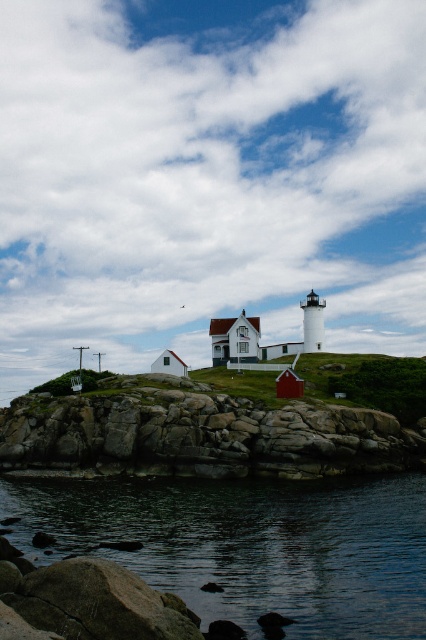
Can you confirm if dark blue water at lower center is positioned to the left of rocky cliff at lower left?

In fact, dark blue water at lower center is to the right of rocky cliff at lower left.

Does point (69, 532) lie in front of point (89, 401)?

That is True.

Is point (328, 547) in front of point (101, 444)?

Yes, it is.

This screenshot has width=426, height=640. I want to click on dark blue water at lower center, so click(252, 545).